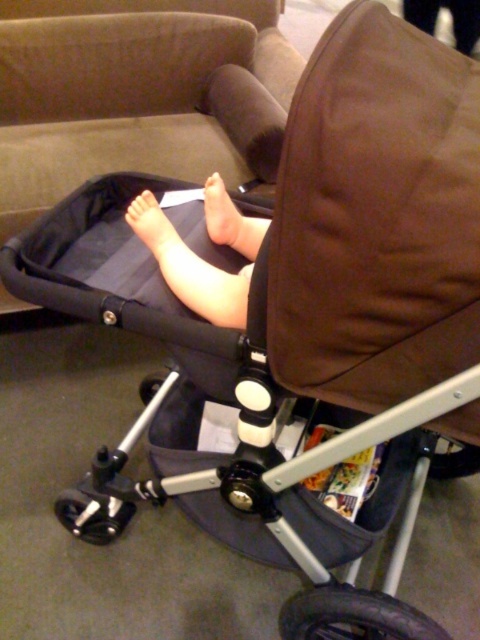
You are a parent trying to place a small blanket on the smooth skin foot at center of your baby in the stroller. You also see the brown fabric couch at upper center nearby. Considering the size difference between the two, which object would require more space to cover with the blanket?

The brown fabric couch at upper center requires more space to cover with the blanket because it has a larger size compared to the smooth skin foot at center.